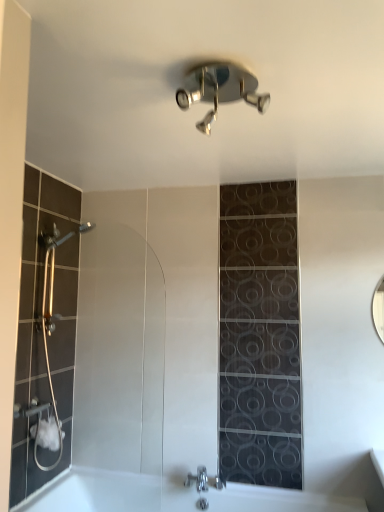
Question: In terms of size, does polished chrome shower at upper center appear bigger or smaller than white glossy bathtub at lower center?

Choices:
 (A) big
 (B) small

Answer: (B)

Question: Do you think polished chrome shower at upper center is within white glossy bathtub at lower center, or outside of it?

Choices:
 (A) inside
 (B) outside

Answer: (B)

Question: Estimate the real-world distances between objects in this image. Which object is farther from the white glossy bathtub at lower center?

Choices:
 (A) polished chrome shower at upper center
 (B) chrome metallic faucet at lower center

Answer: (A)

Question: Considering the real-world distances, which object is farthest from the white glossy bathtub at lower center?

Choices:
 (A) chrome metallic faucet at lower center
 (B) polished chrome shower at upper center

Answer: (B)